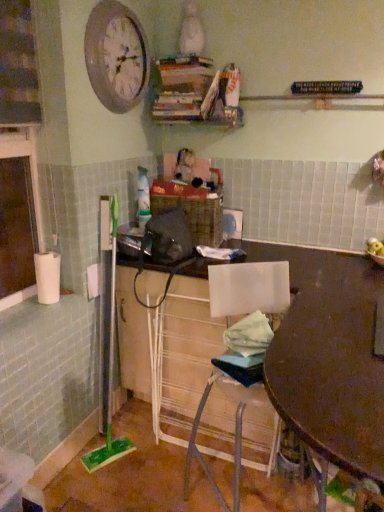
Question: From a real-world perspective, relative to white plastic chair at lower center, is wooden table at center vertically above or below?

Choices:
 (A) above
 (B) below

Answer: (A)

Question: From the image's perspective, is wooden table at center above or below white plastic chair at lower center?

Choices:
 (A) above
 (B) below

Answer: (B)

Question: Which object is the closest to the wooden clock at upper left?

Choices:
 (A) matte brown desk at center
 (B) white plastic chair at lower center
 (C) wooden table at center

Answer: (B)

Question: Based on their relative distances, which object is nearer to the wooden clock at upper left?

Choices:
 (A) matte brown desk at center
 (B) white plastic chair at lower center
 (C) wooden table at center

Answer: (B)